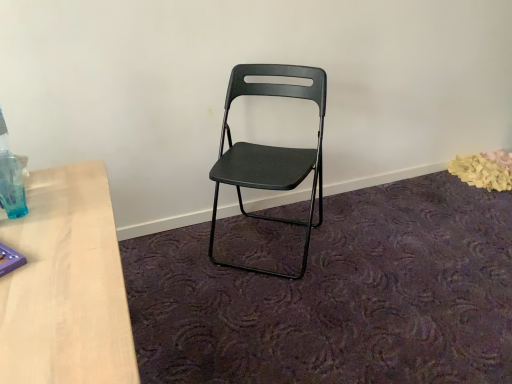
This screenshot has height=384, width=512. Identify the location of free location in front of matte black folding chair at center. (268, 314).